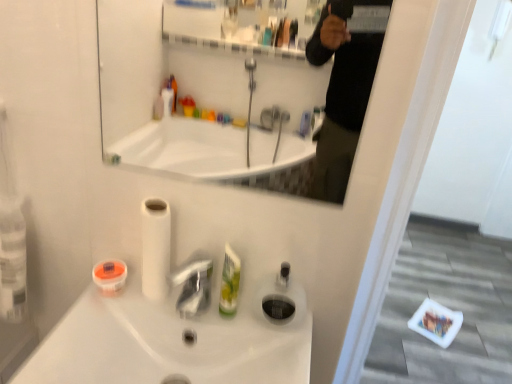
What are the coordinates of `free space in front of orange matte container at lower left, the 1th mouthwash in the left-to-right sequence` in the screenshot? It's located at (83, 328).